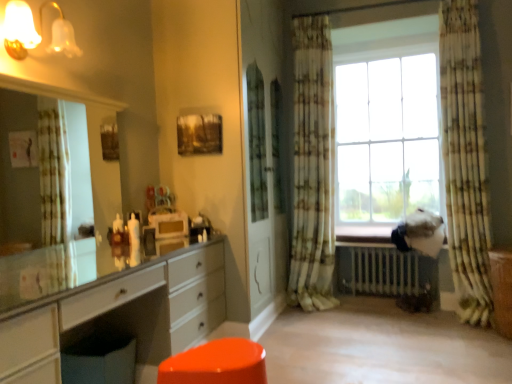
The height and width of the screenshot is (384, 512). Identify the location of free spot in front of metallic silver radiator at lower center. (404, 324).